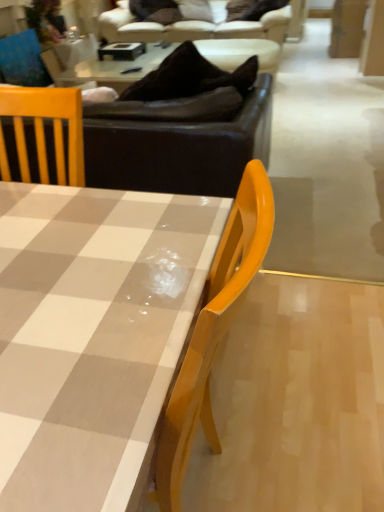
Question: From the image's perspective, is checkered fabric coffee table at center beneath matte brown plywood at upper right?

Choices:
 (A) yes
 (B) no

Answer: (A)

Question: Considering the relative positions of checkered fabric coffee table at center and matte brown plywood at upper right in the image provided, is checkered fabric coffee table at center behind matte brown plywood at upper right?

Choices:
 (A) no
 (B) yes

Answer: (A)

Question: Can you confirm if checkered fabric coffee table at center is taller than matte brown plywood at upper right?

Choices:
 (A) yes
 (B) no

Answer: (A)

Question: From a real-world perspective, is checkered fabric coffee table at center on top of matte brown plywood at upper right?

Choices:
 (A) yes
 (B) no

Answer: (B)

Question: Is matte brown plywood at upper right a part of checkered fabric coffee table at center?

Choices:
 (A) yes
 (B) no

Answer: (B)

Question: From the image's perspective, is checkered fabric coffee table at center above matte brown plywood at upper right?

Choices:
 (A) yes
 (B) no

Answer: (B)

Question: Is matte blue cushion at upper left bigger than checkered fabric coffee table at center?

Choices:
 (A) no
 (B) yes

Answer: (A)

Question: Does matte blue cushion at upper left appear on the left side of checkered fabric coffee table at center?

Choices:
 (A) yes
 (B) no

Answer: (A)

Question: Can you confirm if matte blue cushion at upper left is thinner than checkered fabric coffee table at center?

Choices:
 (A) no
 (B) yes

Answer: (B)

Question: Is matte blue cushion at upper left positioned with its back to checkered fabric coffee table at center?

Choices:
 (A) yes
 (B) no

Answer: (B)

Question: Is matte blue cushion at upper left in front of checkered fabric coffee table at center?

Choices:
 (A) no
 (B) yes

Answer: (A)

Question: Are matte blue cushion at upper left and checkered fabric coffee table at center located far from each other?

Choices:
 (A) no
 (B) yes

Answer: (B)

Question: Is matte brown plywood at upper right looking in the opposite direction of matte blue cushion at upper left?

Choices:
 (A) no
 (B) yes

Answer: (A)